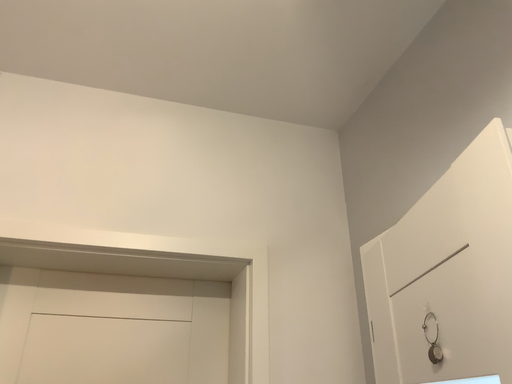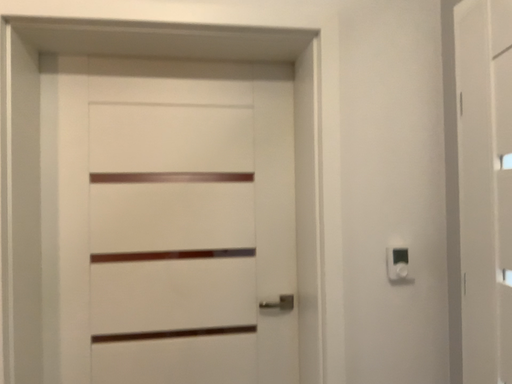
Question: Which way did the camera rotate in the video?

Choices:
 (A) rotated upward
 (B) rotated downward

Answer: (B)